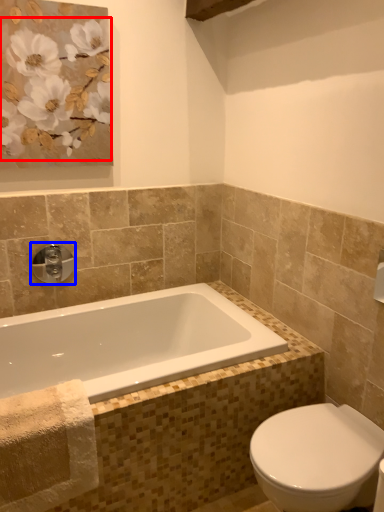
Question: Which of the following is the farthest to the observer, flower (highlighted by a red box) or tap (highlighted by a blue box)?

Choices:
 (A) flower
 (B) tap

Answer: (B)